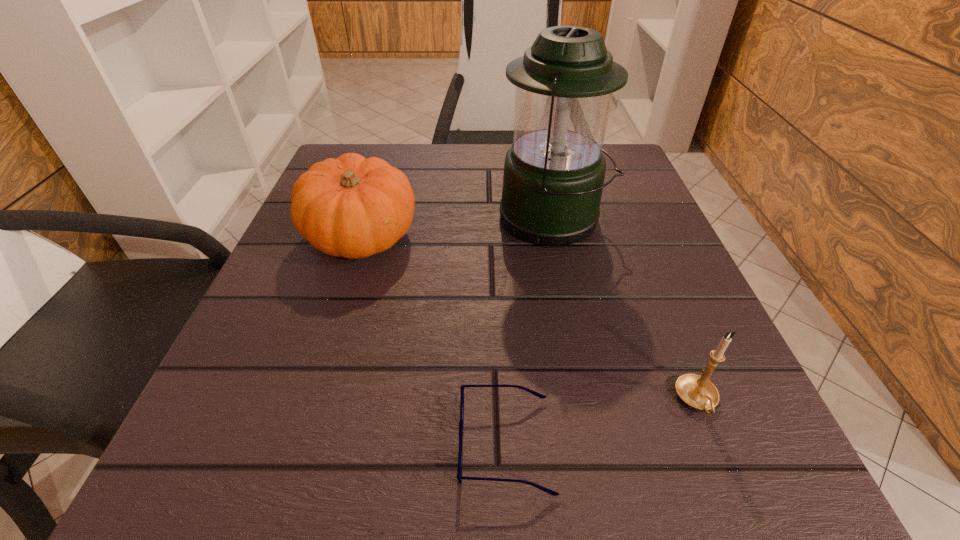
Identify the location of vacant area between the candle holder and the leftmost object. Image resolution: width=960 pixels, height=540 pixels. (529, 319).

Where is `free spot between the tallest object and the pumpkin`? free spot between the tallest object and the pumpkin is located at coordinates (457, 228).

Identify the location of unoccupied position between the spectacles and the pumpkin. (433, 340).

Identify the location of object that is the closest to the candle holder. This screenshot has height=540, width=960. (459, 475).

Select which object appears as the third closest to the tallest object. Please provide its 2D coordinates. Your answer should be formatted as a tuple, i.e. [(x, y)], where the tuple contains the x and y coordinates of a point satisfying the conditions above.

[(459, 475)]

The image size is (960, 540). Identify the location of free spot that satisfies the following two spatial constraints: 1. on the handle side of the rightmost object; 2. on the front-facing side of the shortest object. (714, 444).

At what (x,y) coordinates should I click in order to perform the action: click on free location that satisfies the following two spatial constraints: 1. on the handle side of the candle holder; 2. on the front-facing side of the spectacles. Please return your answer as a coordinate pair (x, y). The height and width of the screenshot is (540, 960). Looking at the image, I should click on (714, 444).

Identify the location of free region that satisfies the following two spatial constraints: 1. on the handle side of the candle holder; 2. on the front-facing side of the shortest object. The image size is (960, 540). (714, 444).

I want to click on vacant space that satisfies the following two spatial constraints: 1. on the handle side of the rightmost object; 2. on the front-facing side of the spectacles, so click(x=714, y=444).

Locate an element on the screen. The height and width of the screenshot is (540, 960). vacant space that satisfies the following two spatial constraints: 1. on the handle side of the rightmost object; 2. on the front-facing side of the shortest object is located at coordinates (714, 444).